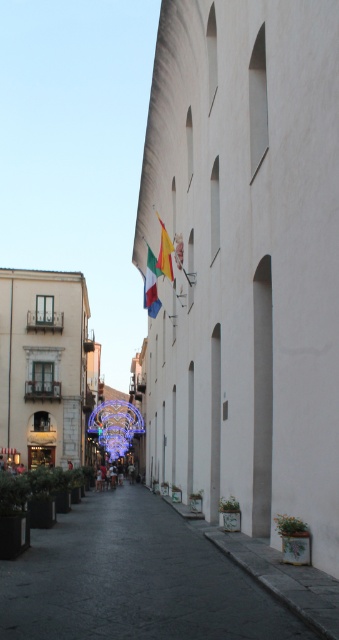
You are standing at the entrance of the narrow street in the Italian town. You see a point marked at coordinates (37, 484). What object is located at that point?

The point at coordinates (37, 484) corresponds to the green matte planter at lower left.

You are standing at the entrance of the street and want to place a new planter exactly where the green matte planter at lower left is currently located. According to the coordinates provided, what are the exact coordinates where you should position the new planter?

The green matte planter at lower left is located at point (37, 484), so you should position the new planter at those exact coordinates.